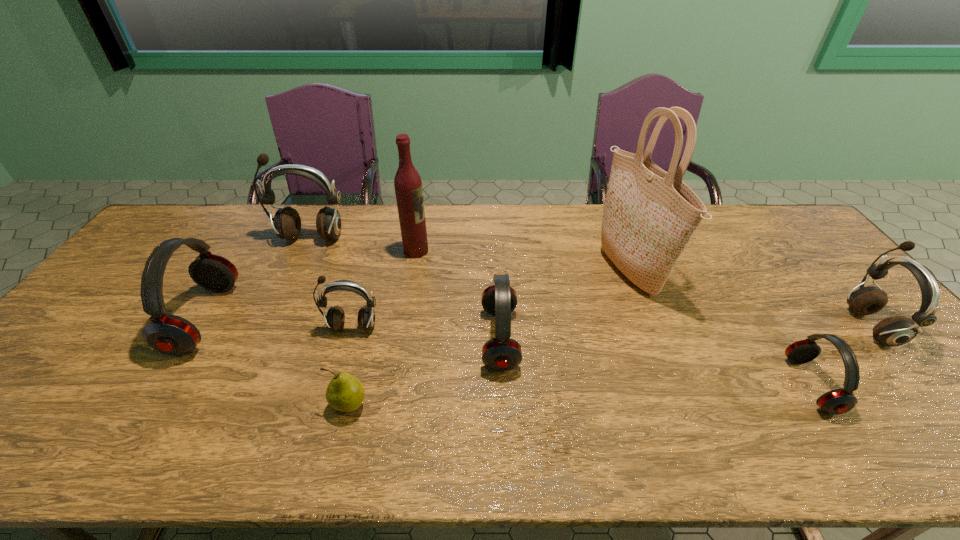
The height and width of the screenshot is (540, 960). What are the coordinates of `vacant space located 0.170m on the ear pads of the rightmost object` in the screenshot? It's located at (788, 326).

Where is `free space located 0.140m on the ear pads of the rightmost object`? free space located 0.140m on the ear pads of the rightmost object is located at coordinates (800, 326).

The height and width of the screenshot is (540, 960). In order to click on blank space located on the ear pads of the rightmost object in this screenshot , I will do `click(796, 326)`.

Image resolution: width=960 pixels, height=540 pixels. In order to click on blank space located on the ear cups of the second biggest red earphone in this screenshot , I will do `click(393, 339)`.

In order to click on free space located on the ear cups of the second biggest red earphone in this screenshot , I will do `click(335, 339)`.

You are a GUI agent. You are given a task and a screenshot of the screen. Output one action in this format:
    pyautogui.click(x=<x>, y=<y>)
    Task: Click on the free region located on the ear cups of the second biggest red earphone
    
    Given the screenshot: What is the action you would take?
    pyautogui.click(x=432, y=339)

You are a GUI agent. You are given a task and a screenshot of the screen. Output one action in this format:
    pyautogui.click(x=<x>, y=<y>)
    Task: Click on the free spot located 0.220m on the ear pads of the fourth earphone from right to left
    The height and width of the screenshot is (540, 960).
    Given the screenshot: What is the action you would take?
    pyautogui.click(x=327, y=412)

Find the location of `vacant area situated on the ear cups of the shortest earphone`. vacant area situated on the ear cups of the shortest earphone is located at coordinates (754, 385).

Locate an element on the screen. Image resolution: width=960 pixels, height=540 pixels. free space located 0.280m on the ear cups of the shortest earphone is located at coordinates (677, 385).

Find the location of a particular element. The image size is (960, 540). vacant space situated on the ear cups of the shortest earphone is located at coordinates pos(631,385).